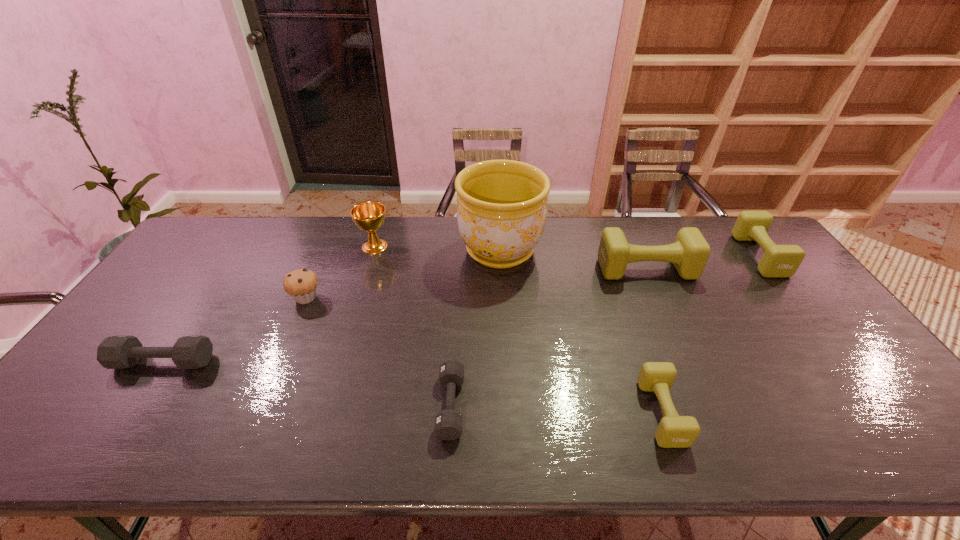
The height and width of the screenshot is (540, 960). Find the location of `flowerpot`. flowerpot is located at coordinates (501, 213).

Locate an element on the screen. The width and height of the screenshot is (960, 540). chalice is located at coordinates (369, 216).

You are a GUI agent. You are given a task and a screenshot of the screen. Output one action in this format:
    pyautogui.click(x=<x>, y=<y>)
    Task: Click on the third object from left to right
    This screenshot has width=960, height=540.
    Given the screenshot: What is the action you would take?
    pyautogui.click(x=369, y=216)

Find the location of a particular element. This screenshot has height=540, width=960. the biggest olive dumbbell is located at coordinates (689, 253).

Where is `the second biggest olive dumbbell`? the second biggest olive dumbbell is located at coordinates (778, 260).

Locate an element on the screen. the second tallest dumbbell is located at coordinates (778, 260).

Where is `the seventh object from right to left`? The image size is (960, 540). the seventh object from right to left is located at coordinates (300, 284).

The width and height of the screenshot is (960, 540). In order to click on the fifth farthest object in this screenshot , I will do `click(300, 284)`.

Where is `the bigger gray dumbbell`? The width and height of the screenshot is (960, 540). the bigger gray dumbbell is located at coordinates (115, 352).

The height and width of the screenshot is (540, 960). I want to click on the left gray dumbbell, so click(115, 352).